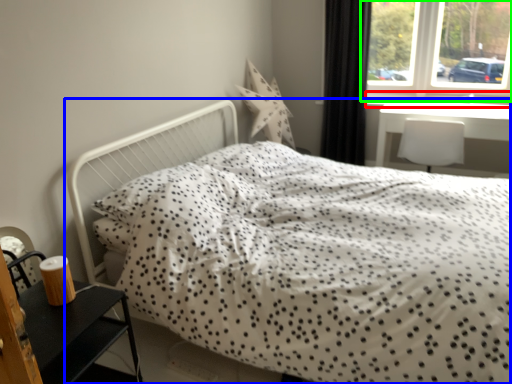
Question: Considering the real-world distances, which object is closest to window sill (highlighted by a red box)? bed (highlighted by a blue box) or window (highlighted by a green box).

Choices:
 (A) bed
 (B) window

Answer: (B)